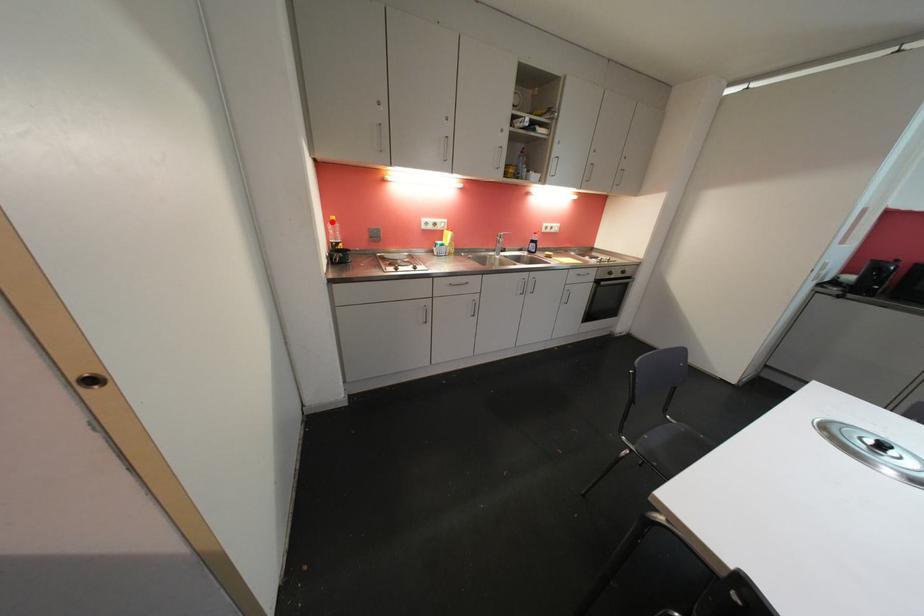
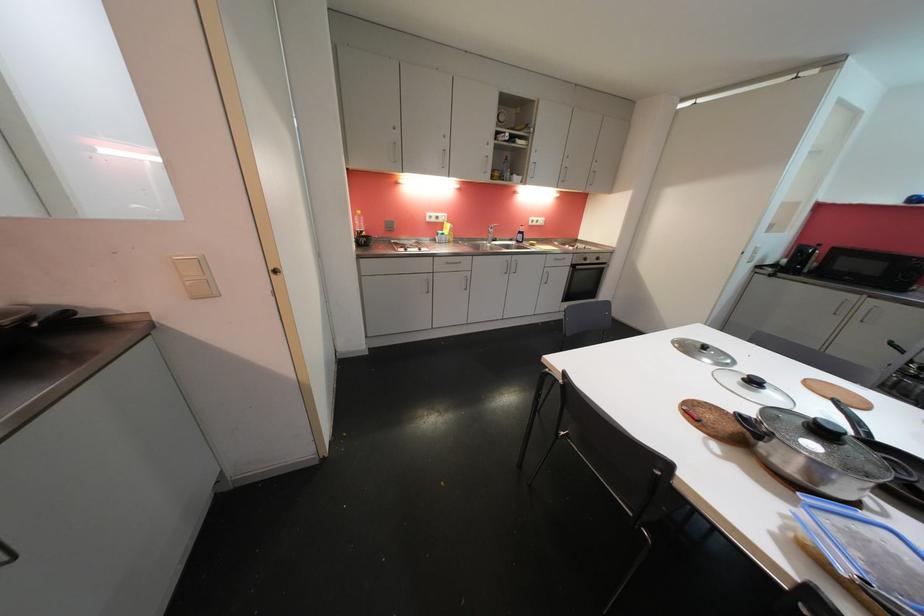
Locate, in the second image, the point that corresponds to the highlighted location in the first image.

(359, 216)